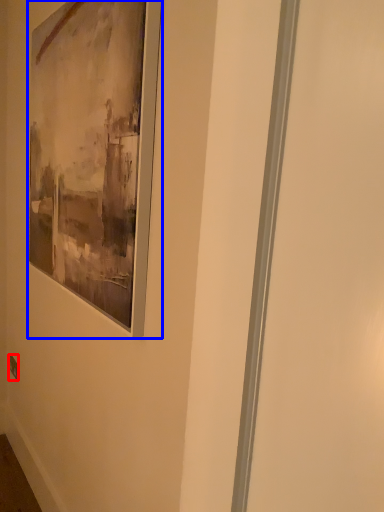
Question: Which of the following is the closest to the observer, electric outlet (highlighted by a red box) or picture frame (highlighted by a blue box)?

Choices:
 (A) electric outlet
 (B) picture frame

Answer: (B)